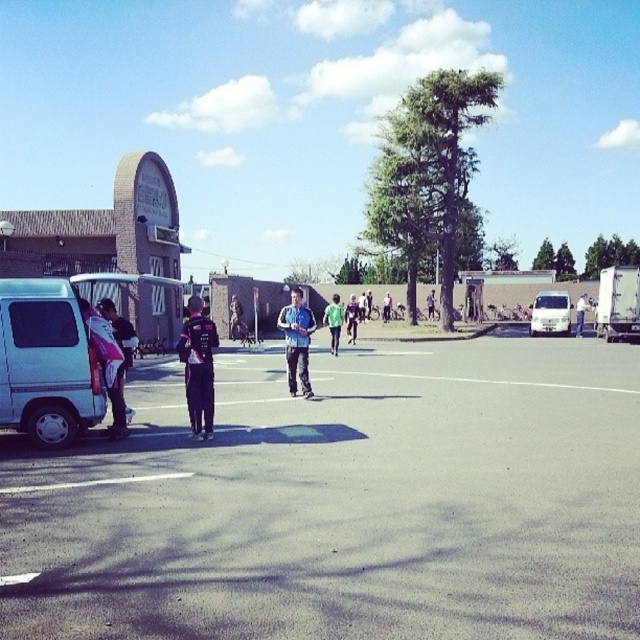
Question: Can you confirm if dark blue fabric jacket at center is wider than dark blue jacket at center?

Choices:
 (A) no
 (B) yes

Answer: (B)

Question: Does black asphalt parking lot at center have a smaller size compared to pink fabric jacket at left?

Choices:
 (A) yes
 (B) no

Answer: (B)

Question: Which point is farther to the camera?

Choices:
 (A) black asphalt parking lot at center
 (B) green fabric backpack at center
 (C) dark blue jacket at center

Answer: (B)

Question: Is white matte van at left further to the viewer compared to green fabric backpack at center?

Choices:
 (A) no
 (B) yes

Answer: (A)

Question: Which point is farther from the camera taking this photo?

Choices:
 (A) (600, 595)
 (B) (330, 346)
 (C) (564, 298)

Answer: (C)

Question: Among these points, which one is nearest to the camera?

Choices:
 (A) [x=339, y=330]
 (B) [x=557, y=307]
 (C) [x=186, y=326]
 (D) [x=84, y=301]

Answer: (D)